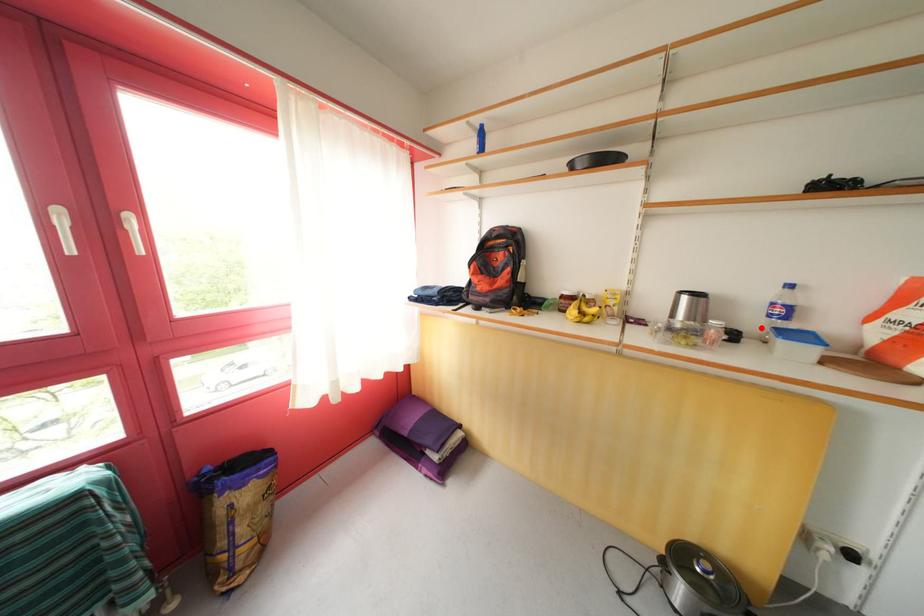
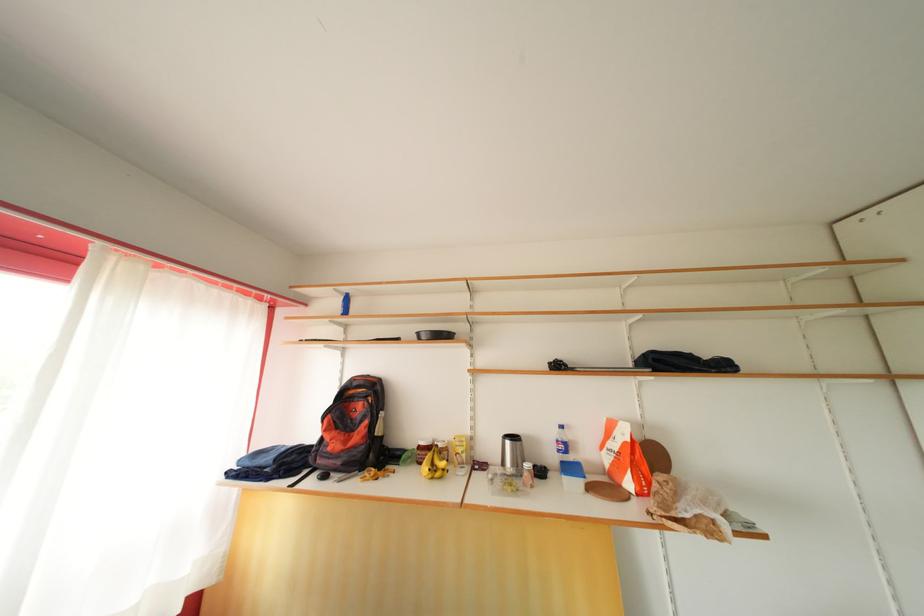
In the second image, find the point that corresponds to the highlighted location in the first image.

(558, 463)